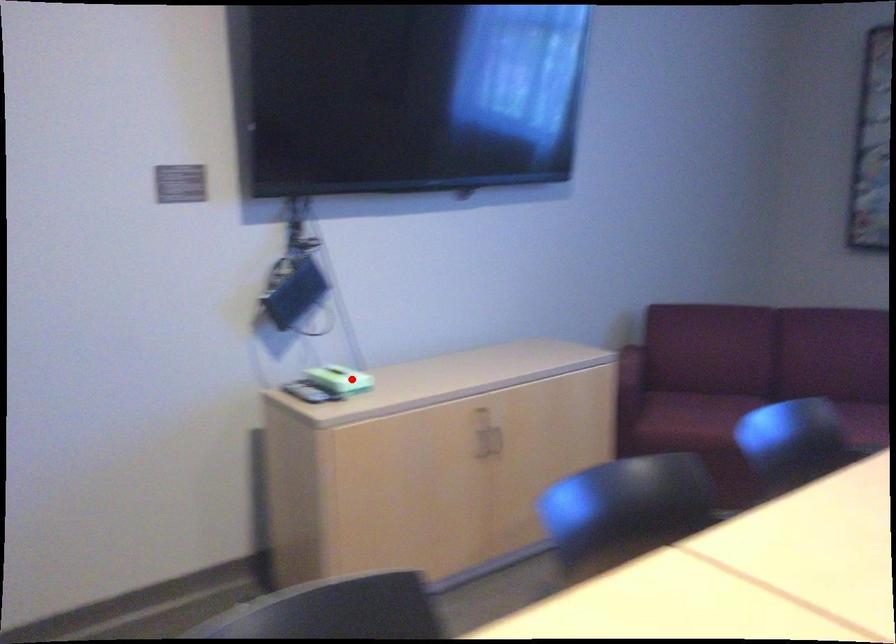
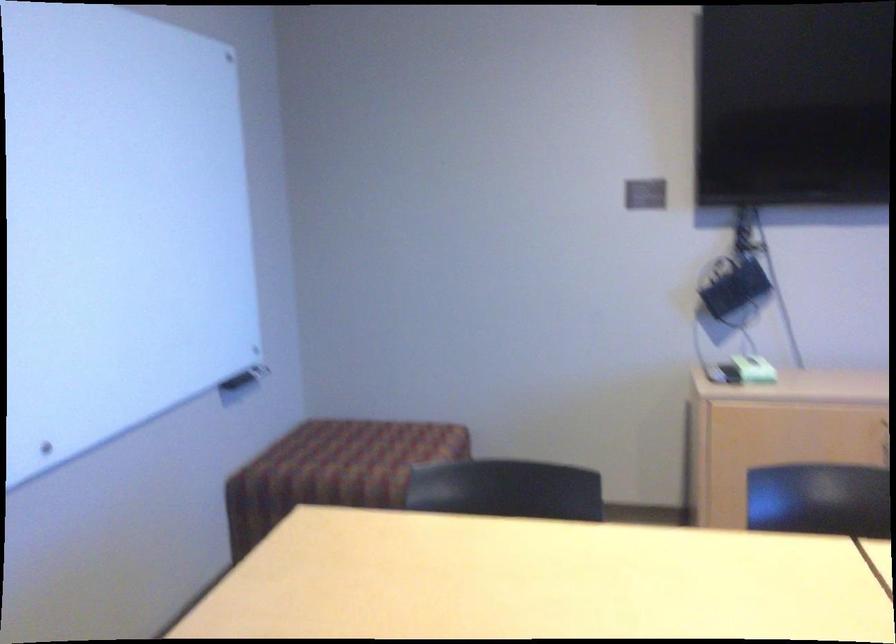
Locate, in the second image, the point that corresponds to the highlighted location in the first image.

(754, 368)